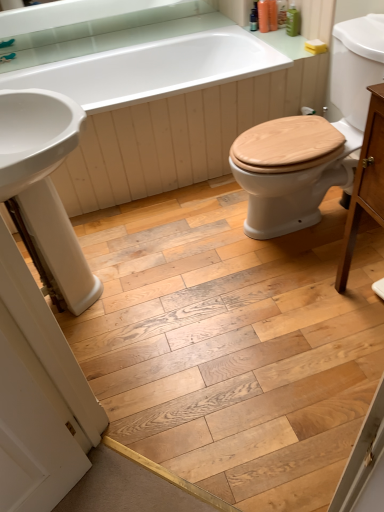
Where is `vacant space underneath white glossy sink at left (from a real-world perspective)`? Image resolution: width=384 pixels, height=512 pixels. vacant space underneath white glossy sink at left (from a real-world perspective) is located at coordinates (102, 292).